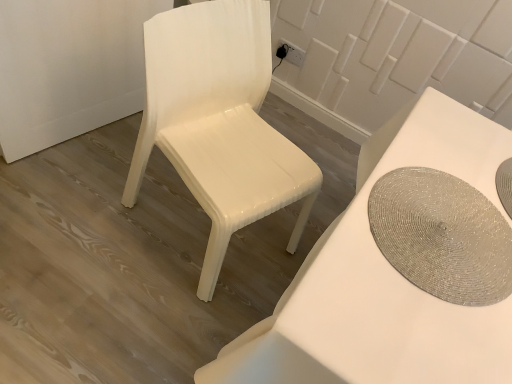
Where is `unoccupied space behind shiny silver placemat at right`? The height and width of the screenshot is (384, 512). unoccupied space behind shiny silver placemat at right is located at coordinates (455, 151).